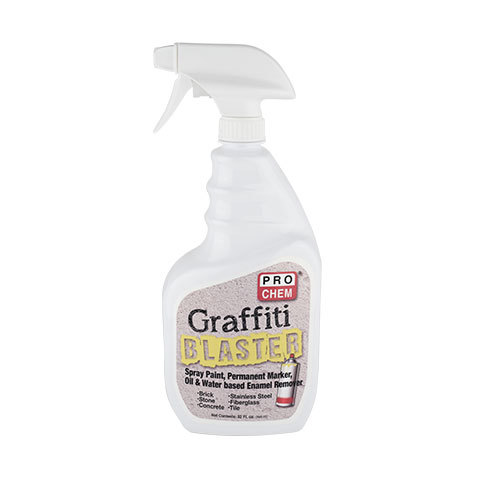
Find the location of a particular element. spray bottle is located at coordinates (262, 229).